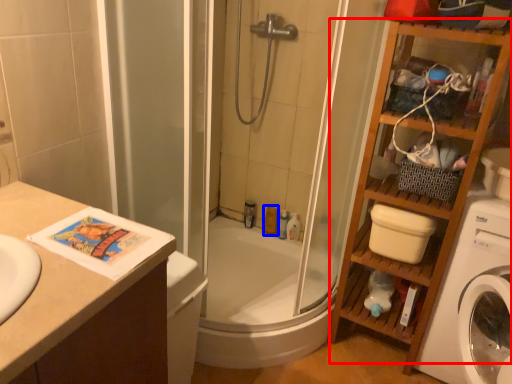
Question: Which point is further to the camera, cabinet (highlighted by a red box) or toiletry (highlighted by a blue box)?

Choices:
 (A) cabinet
 (B) toiletry

Answer: (B)